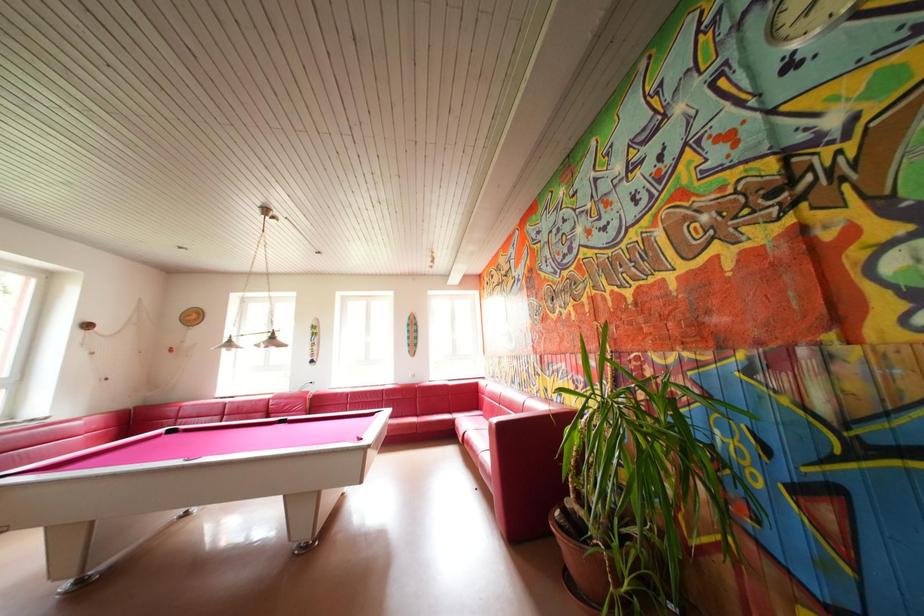
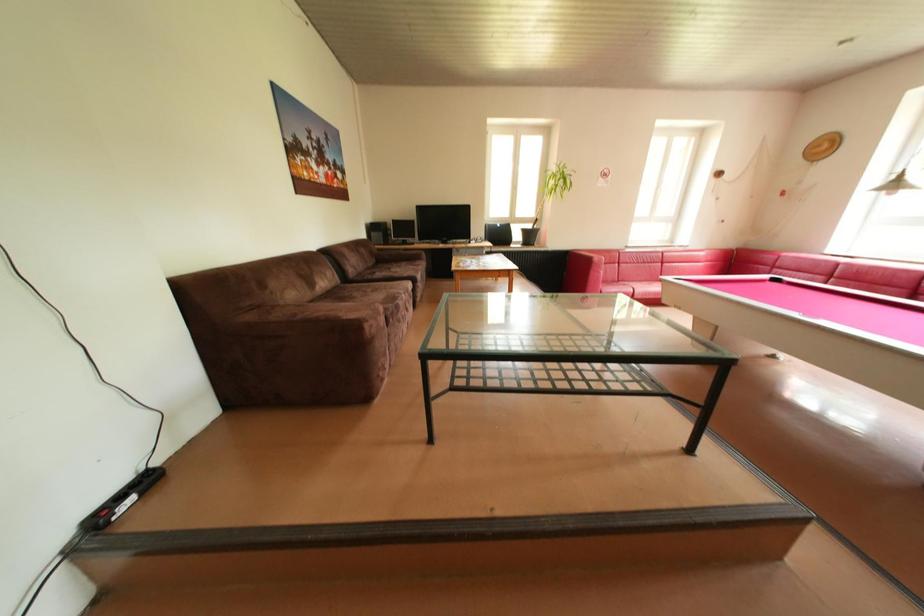
The images are taken continuously from a first-person perspective. In which direction is your viewpoint rotating?

The camera rotated toward left-down.